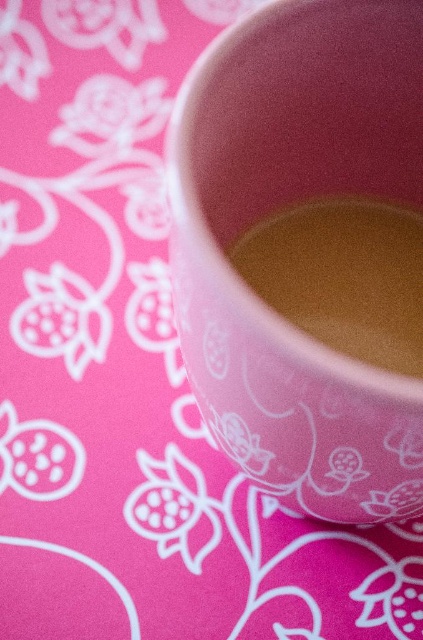
Can you confirm if matte pink cup at center is shorter than golden matte liquid at center?

Incorrect, matte pink cup at center's height does not fall short of golden matte liquid at center's.

From the picture: Which of these two, matte pink cup at center or golden matte liquid at center, stands shorter?

With less height is golden matte liquid at center.

You are a GUI agent. You are given a task and a screenshot of the screen. Output one action in this format:
    pyautogui.click(x=<x>, y=<y>)
    Task: Click on the matte pink cup at center
    
    Given the screenshot: What is the action you would take?
    pyautogui.click(x=279, y=209)

What are the coordinates of `matte pink cup at center` in the screenshot? It's located at (279, 209).